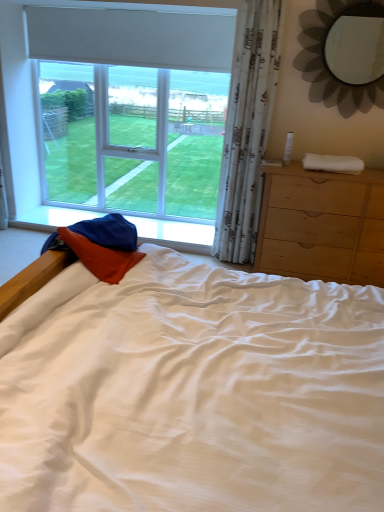
Question: Can you confirm if white sheer curtain at right is smaller than light brown wooden chest of drawers at right?

Choices:
 (A) yes
 (B) no

Answer: (A)

Question: From a real-world perspective, does white sheer curtain at right sit lower than light brown wooden chest of drawers at right?

Choices:
 (A) yes
 (B) no

Answer: (B)

Question: Can you confirm if white sheer curtain at right is thinner than light brown wooden chest of drawers at right?

Choices:
 (A) yes
 (B) no

Answer: (A)

Question: From a real-world perspective, is white sheer curtain at right positioned over light brown wooden chest of drawers at right based on gravity?

Choices:
 (A) no
 (B) yes

Answer: (B)

Question: Is white sheer curtain at right far away from light brown wooden chest of drawers at right?

Choices:
 (A) no
 (B) yes

Answer: (A)

Question: Considering the positions of white matte window at upper left and metallic flower-shaped mirror at upper right in the image, is white matte window at upper left taller or shorter than metallic flower-shaped mirror at upper right?

Choices:
 (A) short
 (B) tall

Answer: (B)

Question: From a real-world perspective, is white matte window at upper left above or below metallic flower-shaped mirror at upper right?

Choices:
 (A) below
 (B) above

Answer: (A)

Question: Looking at the image, does white matte window at upper left seem bigger or smaller compared to metallic flower-shaped mirror at upper right?

Choices:
 (A) small
 (B) big

Answer: (B)

Question: Considering the positions of point (168, 38) and point (372, 102), is point (168, 38) closer or farther from the camera than point (372, 102)?

Choices:
 (A) farther
 (B) closer

Answer: (A)

Question: Is metallic flower-shaped mirror at upper right to the left or to the right of light brown wooden chest of drawers at right in the image?

Choices:
 (A) left
 (B) right

Answer: (B)

Question: Considering the positions of metallic flower-shaped mirror at upper right and light brown wooden chest of drawers at right in the image, is metallic flower-shaped mirror at upper right taller or shorter than light brown wooden chest of drawers at right?

Choices:
 (A) tall
 (B) short

Answer: (B)

Question: Does point (301, 32) appear closer or farther from the camera than point (375, 215)?

Choices:
 (A) closer
 (B) farther

Answer: (B)

Question: From a real-world perspective, is metallic flower-shaped mirror at upper right above or below light brown wooden chest of drawers at right?

Choices:
 (A) below
 (B) above

Answer: (B)

Question: Would you say white matte window at upper left is inside or outside white sheer curtain at right?

Choices:
 (A) inside
 (B) outside

Answer: (B)

Question: Is white matte window at upper left to the left or to the right of white sheer curtain at right in the image?

Choices:
 (A) left
 (B) right

Answer: (A)